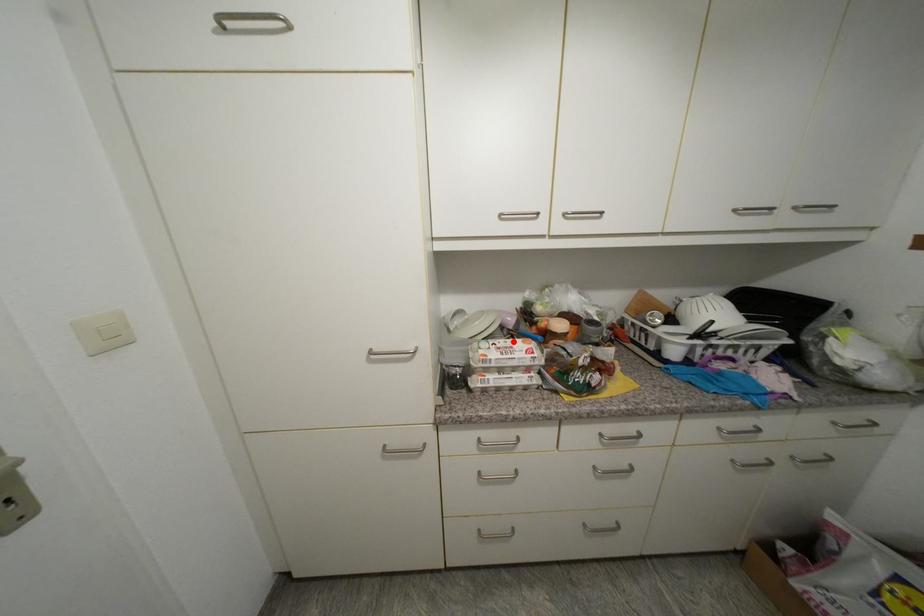
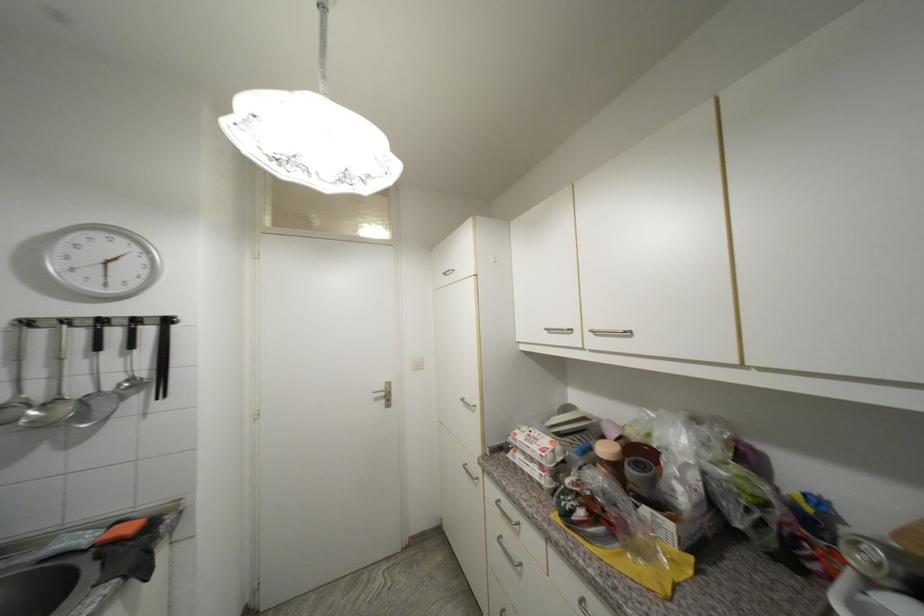
In the second image, find the point that corresponds to the highlighted location in the first image.

(548, 436)